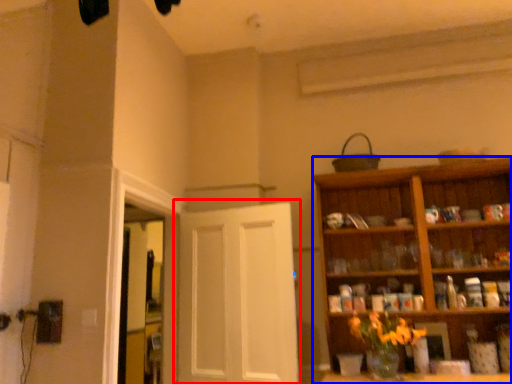
Question: Which object appears farthest to the camera in this image, door (highlighted by a red box) or cabinetry (highlighted by a blue box)?

Choices:
 (A) door
 (B) cabinetry

Answer: (A)